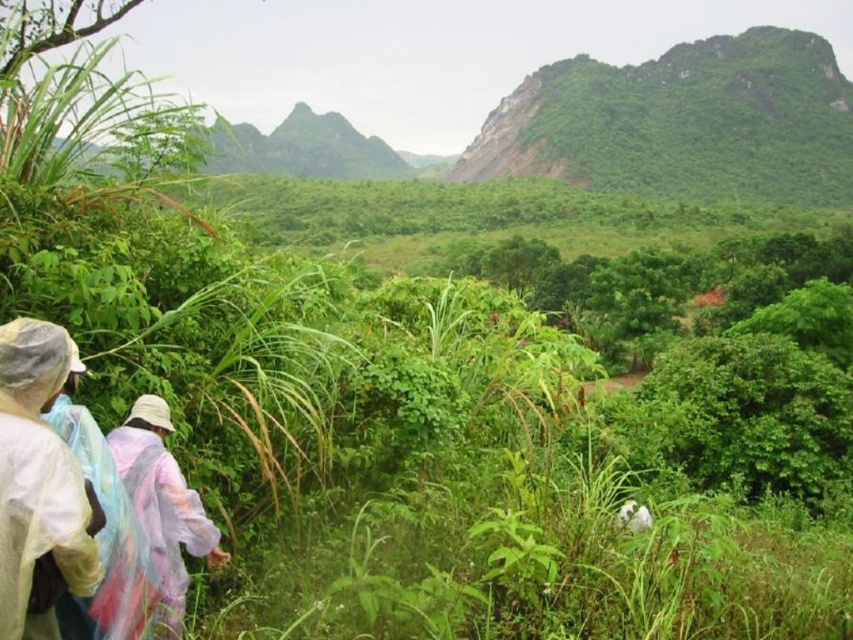
Question: Which of the following is the farthest from the observer?

Choices:
 (A) (16, 461)
 (B) (175, 598)

Answer: (B)

Question: Does transparent plastic raincoat at lower left have a lesser width compared to raincoat fabric at lower left?

Choices:
 (A) no
 (B) yes

Answer: (B)

Question: Does green leafy hillside at upper right have a larger size compared to transparent plastic raincoat at lower left?

Choices:
 (A) no
 (B) yes

Answer: (B)

Question: Which of these objects is positioned closest to the transparent plastic raincoat at lower left?

Choices:
 (A) raincoat fabric at lower left
 (B) green leafy hillside at upper right

Answer: (A)

Question: Which point is farther to the camera?

Choices:
 (A) transparent plastic raincoat at lower left
 (B) green leafy hillside at upper right

Answer: (B)

Question: Observing the image, what is the correct spatial positioning of green leafy hillside at upper right in reference to transparent plastic raincoat at lower left?

Choices:
 (A) above
 (B) below

Answer: (A)